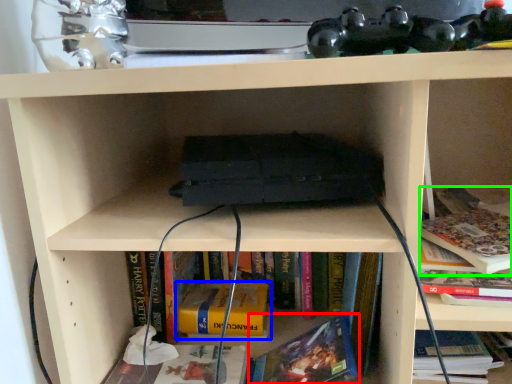
Question: Which is nearer to the book (highlighted by a red box)? book (highlighted by a blue box) or book (highlighted by a green box).

Choices:
 (A) book
 (B) book

Answer: (A)